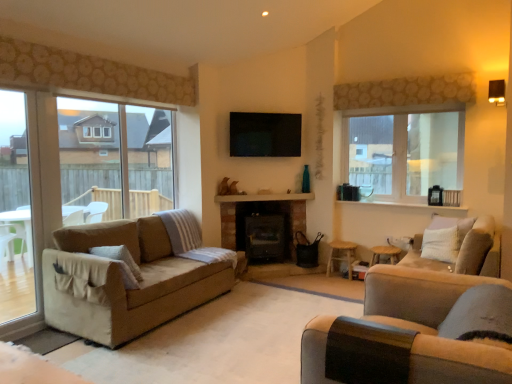
Question: In terms of width, does brick fireplace at center look wider or thinner when compared to wooden stool at center, the second stool in the right-to-left sequence?

Choices:
 (A) thin
 (B) wide

Answer: (A)

Question: Would you say brick fireplace at center is to the left or to the right of wooden stool at center, the second stool in the right-to-left sequence, in the picture?

Choices:
 (A) left
 (B) right

Answer: (A)

Question: Which of these objects is positioned farthest from the wooden stool at lower right, which is the first stool from right to left?

Choices:
 (A) clear glass door at left
 (B) beige fabric couch at right
 (C) brick fireplace at center
 (D) clear glass window at upper right, the second window in the left-to-right sequence
 (E) black matte fireplace at center

Answer: (A)

Question: Considering the real-world distances, which object is farthest from the beige fabric couch at lower right, marked as the 2th studio couch in a right-to-left arrangement?

Choices:
 (A) black matte fireplace at center
 (B) wooden stool at lower right, which is the first stool from right to left
 (C) clear glass window at upper right, the 1th window in the right-to-left sequence
 (D) wooden stool at center, the first stool in the left-to-right sequence
 (E) brick fireplace at center

Answer: (E)